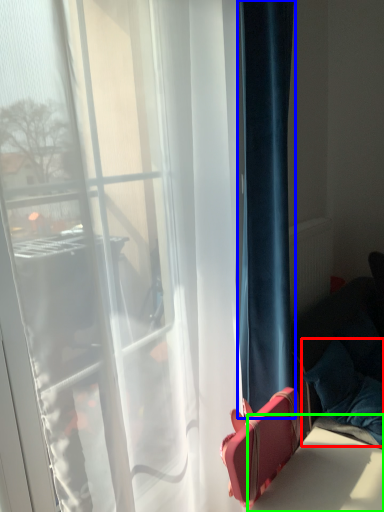
Question: Based on their relative distances, which object is farther from pillow (highlighted by a red box)? Choose from curtain (highlighted by a blue box) and table (highlighted by a green box).

Choices:
 (A) curtain
 (B) table

Answer: (A)